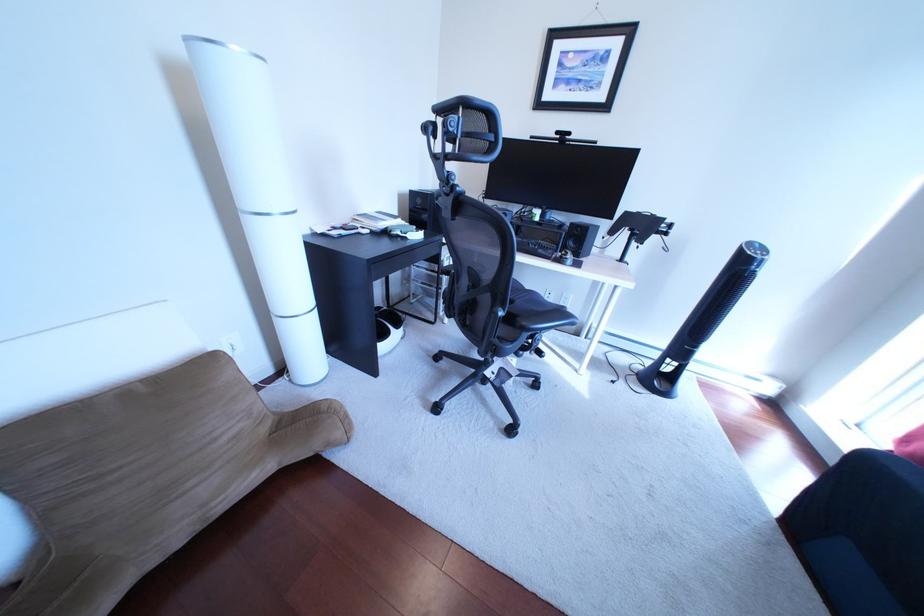
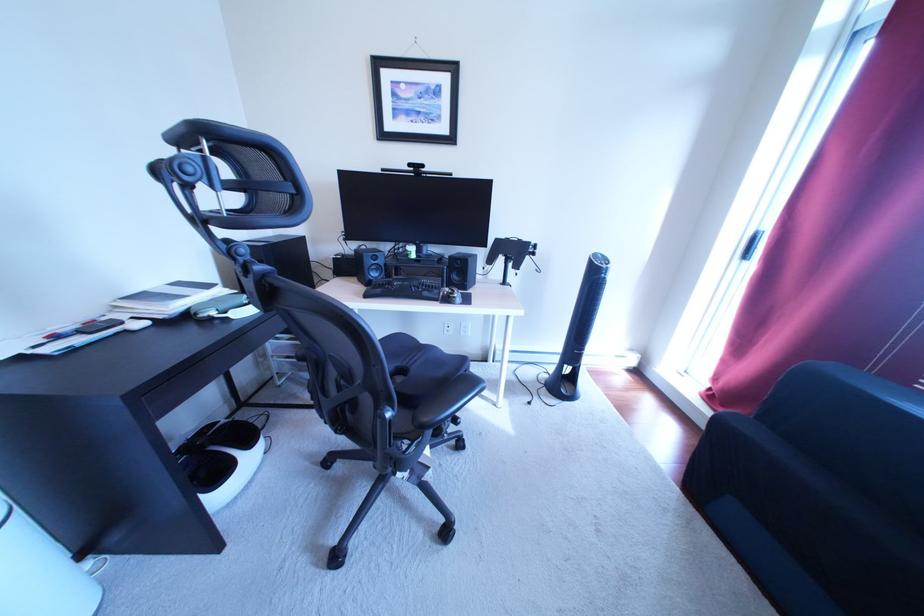
Which direction would the cameraman need to move to produce the second image?

The cameraman moved toward right, forward.